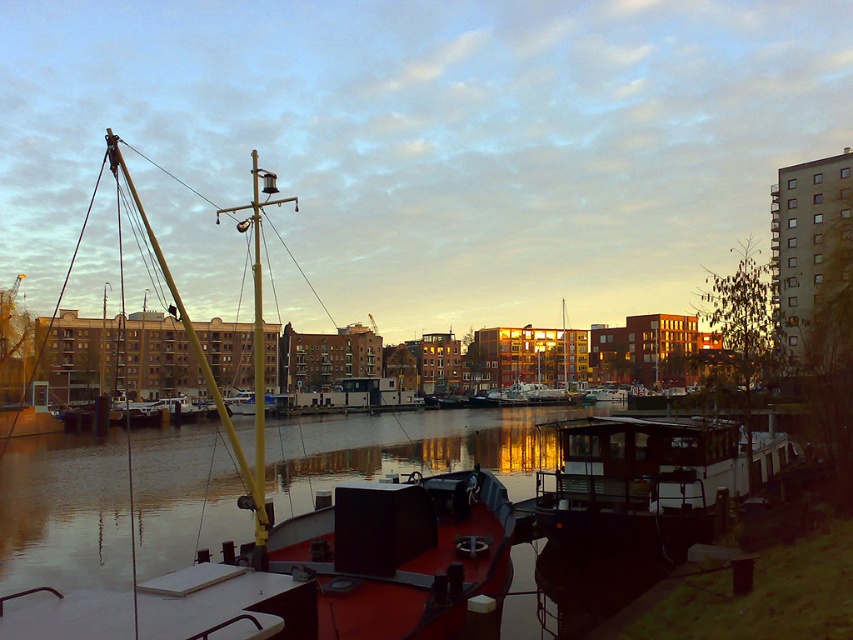
Can you confirm if smooth red boat at center is bigger than wooden cabin cruiser at center?

Yes, smooth red boat at center is bigger than wooden cabin cruiser at center.

Where is `smooth red boat at center`? smooth red boat at center is located at coordinates (317, 573).